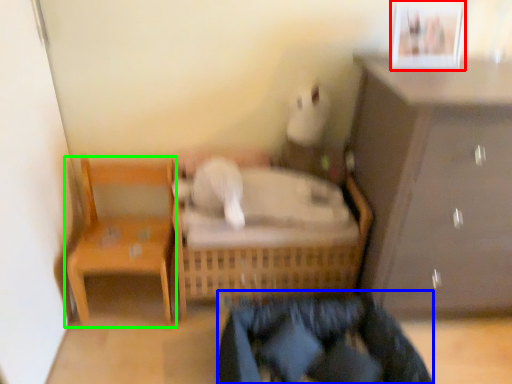
Question: Based on their relative distances, which object is farther from picture frame (highlighted by a red box)? Choose from clothing (highlighted by a blue box) and chair (highlighted by a green box).

Choices:
 (A) clothing
 (B) chair

Answer: (B)